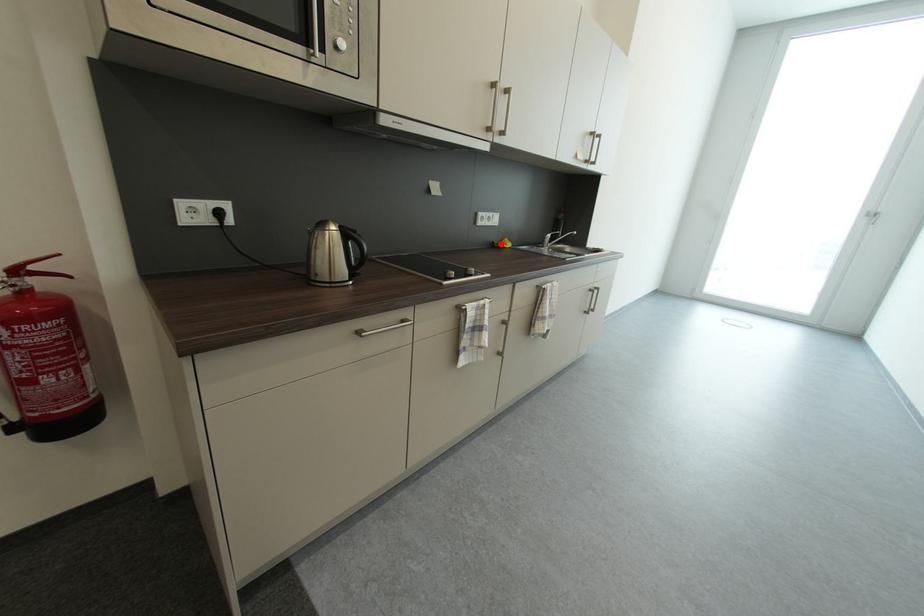
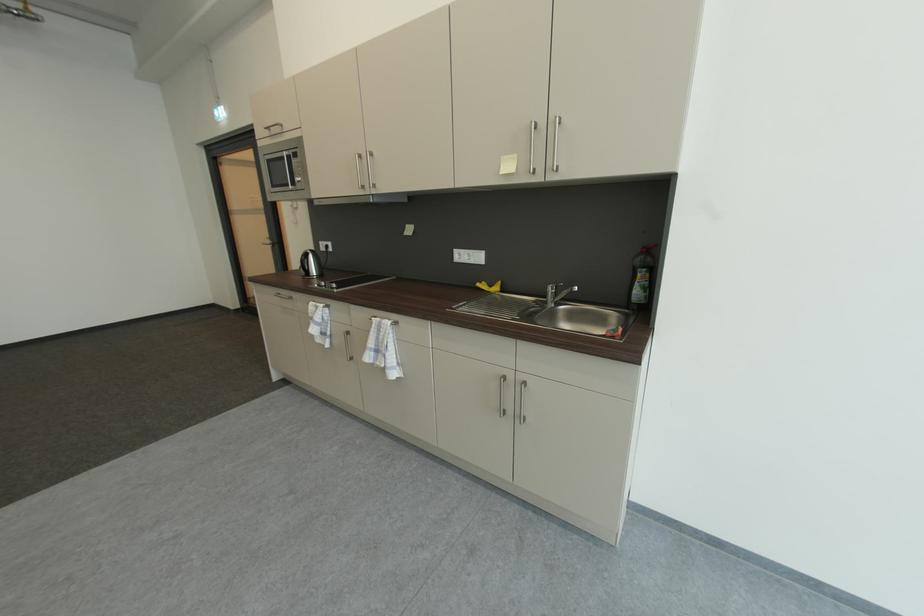
In the second image, find the point that corresponds to the highlighted location in the first image.

(487, 284)